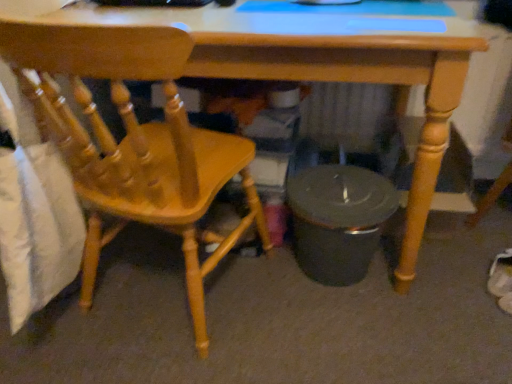
Question: Is wooden desk at center far away from matte wood chair at left?

Choices:
 (A) yes
 (B) no

Answer: (B)

Question: Does wooden desk at center come behind matte wood chair at left?

Choices:
 (A) no
 (B) yes

Answer: (B)

Question: Is wooden desk at center surrounding matte wood chair at left?

Choices:
 (A) no
 (B) yes

Answer: (A)

Question: Can you confirm if wooden desk at center is positioned to the right of matte wood chair at left?

Choices:
 (A) yes
 (B) no

Answer: (A)

Question: From a real-world perspective, is wooden desk at center located beneath matte wood chair at left?

Choices:
 (A) no
 (B) yes

Answer: (B)

Question: Does wooden desk at center have a smaller size compared to matte wood chair at left?

Choices:
 (A) no
 (B) yes

Answer: (A)

Question: Is matte wood chair at left at the right side of wooden desk at center?

Choices:
 (A) yes
 (B) no

Answer: (B)

Question: Is matte wood chair at left positioned in front of wooden desk at center?

Choices:
 (A) no
 (B) yes

Answer: (B)

Question: Are matte wood chair at left and wooden desk at center beside each other?

Choices:
 (A) no
 (B) yes

Answer: (A)

Question: Can you confirm if matte wood chair at left is shorter than wooden desk at center?

Choices:
 (A) yes
 (B) no

Answer: (B)

Question: Is wooden desk at center located within matte wood chair at left?

Choices:
 (A) yes
 (B) no

Answer: (B)

Question: From the image's perspective, is matte wood chair at left under wooden desk at center?

Choices:
 (A) no
 (B) yes

Answer: (B)

Question: Would you say wooden desk at center is to the left or to the right of matte wood chair at left in the picture?

Choices:
 (A) left
 (B) right

Answer: (B)